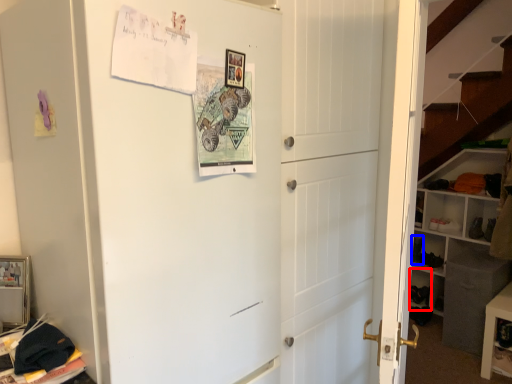
Question: Which point is closer to the camera, cabinet (highlighted by a red box) or shoe (highlighted by a blue box)?

Choices:
 (A) cabinet
 (B) shoe

Answer: (A)